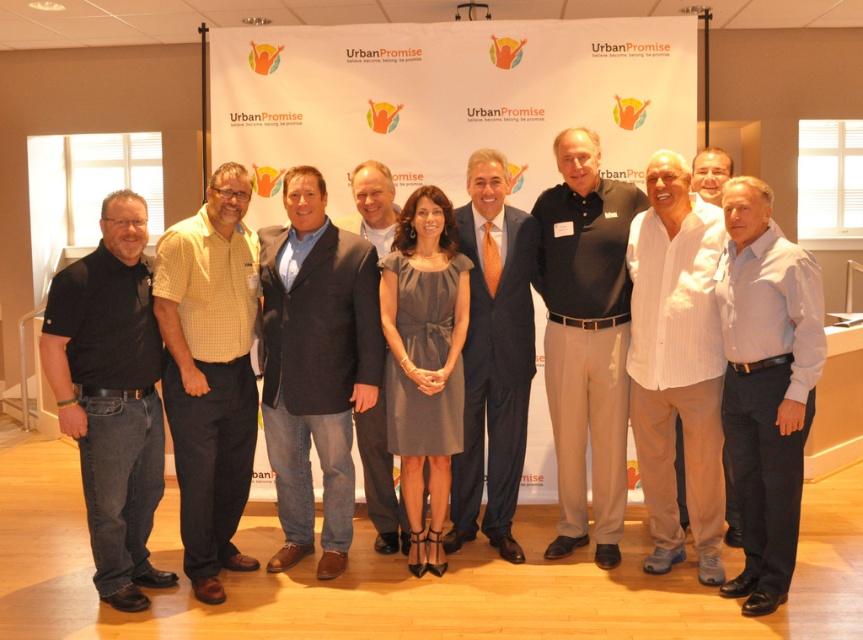
Question: Which point is farther to the camera?

Choices:
 (A) (241, 560)
 (B) (605, 396)
 (C) (394, 227)
 (D) (721, 172)

Answer: (D)

Question: Can you confirm if black cotton polo shirt at center is positioned to the right of gray satin dress at center?

Choices:
 (A) yes
 (B) no

Answer: (A)

Question: Which of these objects is positioned closest to the black cotton polo shirt at center?

Choices:
 (A) white striped shirt at center
 (B) yellow checkered shirt at center

Answer: (A)

Question: Does matte navy suit at center come in front of gray satin dress at center?

Choices:
 (A) yes
 (B) no

Answer: (B)

Question: Is gray satin dress at center thinner than dark gray suit at center?

Choices:
 (A) no
 (B) yes

Answer: (A)

Question: Which object is the farthest from the blue denim jeans at center?

Choices:
 (A) yellow checkered shirt at center
 (B) white striped shirt at center
 (C) black cotton polo shirt at center
 (D) black cotton shirt at left

Answer: (B)